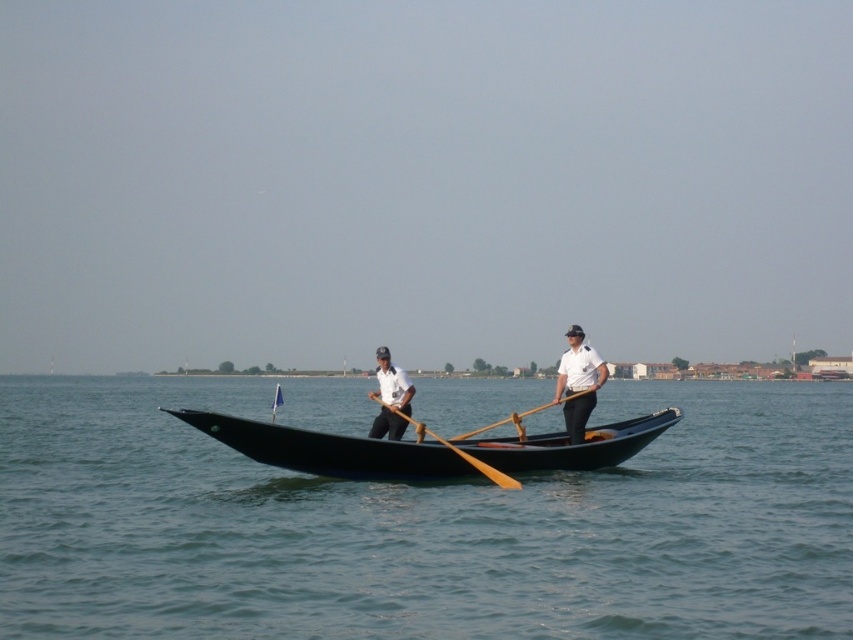
Is smooth blue water at center smaller than wooden paddle at center?

Incorrect, smooth blue water at center is not smaller in size than wooden paddle at center.

Does smooth blue water at center have a larger size compared to wooden paddle at center?

Correct, smooth blue water at center is larger in size than wooden paddle at center.

Identify the location of smooth blue water at center. This screenshot has width=853, height=640. (421, 525).

Is white matte shirt at center above wooden paddle at center?

Indeed, white matte shirt at center is positioned over wooden paddle at center.

Is point (379, 422) positioned behind point (576, 392)?

No, it is not.

Where is `white matte shirt at center`? white matte shirt at center is located at coordinates (390, 397).

From the picture: Is black polished wood canoe at center closer to camera compared to wooden paddle at center?

Yes, black polished wood canoe at center is closer to the viewer.

Is point (364, 477) in front of point (469, 435)?

Yes, point (364, 477) is closer to viewer.

Between point (607, 433) and point (529, 410), which one is positioned behind?

Point (529, 410)

You are a GUI agent. You are given a task and a screenshot of the screen. Output one action in this format:
    pyautogui.click(x=<x>, y=<y>)
    Task: Click on the black polished wood canoe at center
    Image resolution: width=853 pixels, height=640 pixels.
    Given the screenshot: What is the action you would take?
    [426, 449]